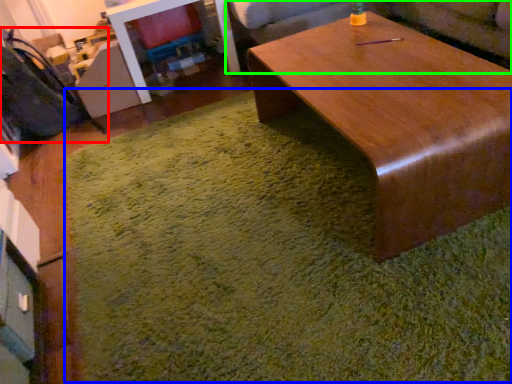
Question: Which object is the closest to the swivel chair (highlighted by a red box)? Choose among these: mat (highlighted by a blue box) or couch (highlighted by a green box).

Choices:
 (A) mat
 (B) couch

Answer: (A)